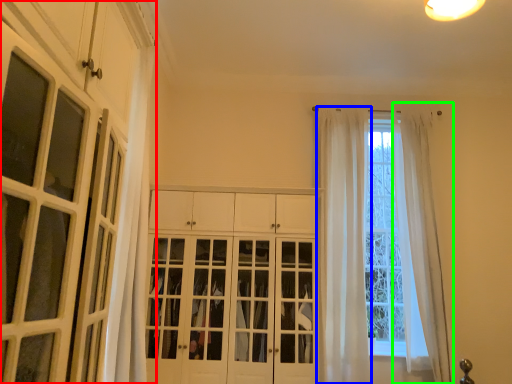
Question: Estimate the real-world distances between objects in this image. Which object is farther from cabinetry (highlighted by a red box), curtain (highlighted by a blue box) or curtain (highlighted by a green box)?

Choices:
 (A) curtain
 (B) curtain

Answer: (B)